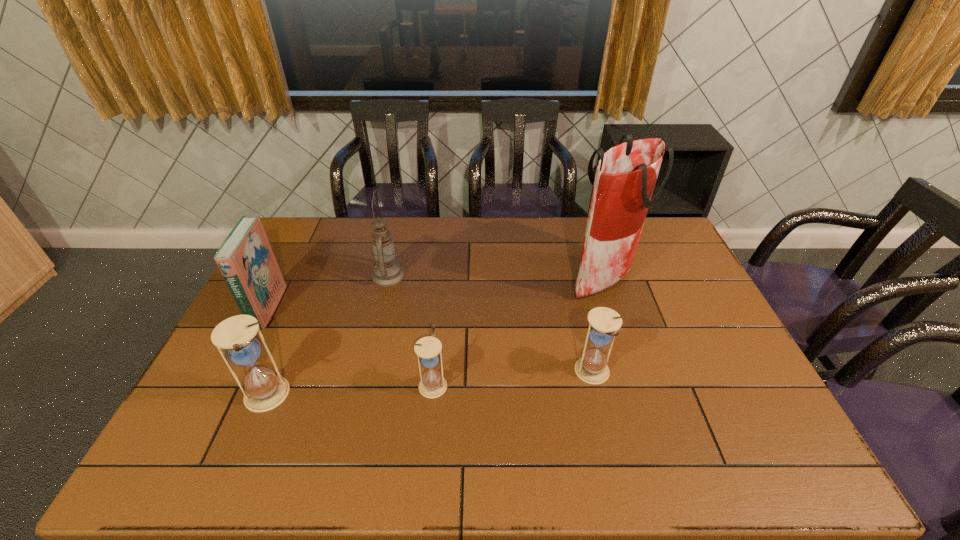
Locate an element on the screen. The image size is (960, 540). the leftmost hourglass is located at coordinates (264, 390).

Find the location of a particular element. the tallest hourglass is located at coordinates (264, 390).

In order to click on the third object from right to left in this screenshot , I will do tap(428, 349).

Image resolution: width=960 pixels, height=540 pixels. I want to click on the shortest object, so click(x=428, y=349).

I want to click on the rightmost hourglass, so click(592, 368).

The width and height of the screenshot is (960, 540). In order to click on the fifth tallest object in this screenshot , I will do `click(592, 368)`.

Where is `the third object from left to right`? This screenshot has height=540, width=960. the third object from left to right is located at coordinates (387, 272).

Find the location of `grocery bag`. grocery bag is located at coordinates (626, 174).

The height and width of the screenshot is (540, 960). I want to click on the leftmost object, so click(x=246, y=260).

At what (x,y) coordinates should I click in order to perform the action: click on free space located 0.050m on the back of the tallest hourglass. Please return your answer as a coordinate pair (x, y). Image resolution: width=960 pixels, height=540 pixels. Looking at the image, I should click on (280, 361).